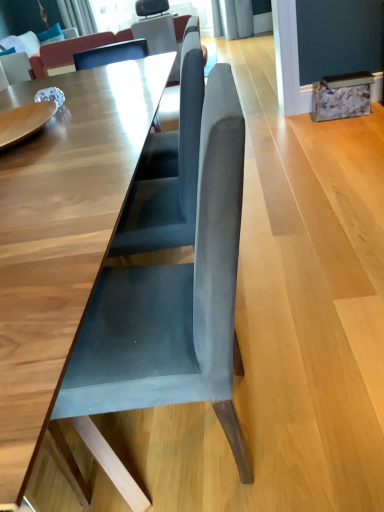
The width and height of the screenshot is (384, 512). I want to click on free space to the right of suede gray chair at center, so click(315, 385).